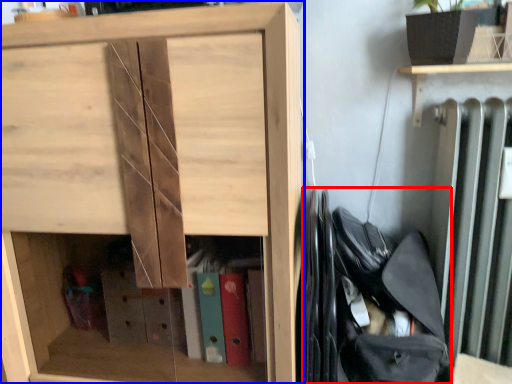
Question: Which point is further to the camera, bag (highlighted by a red box) or cupboard (highlighted by a blue box)?

Choices:
 (A) bag
 (B) cupboard

Answer: (A)